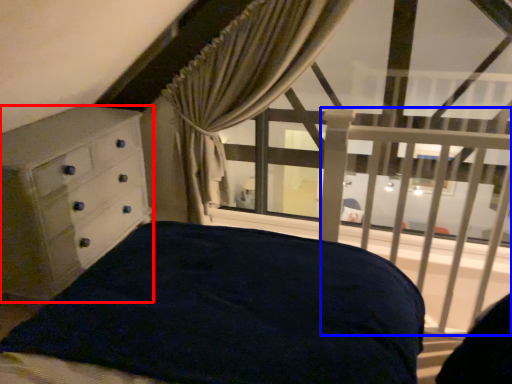
Question: Which object appears closest to the camera in this image, chest of drawers (highlighted by a red box) or balustrade (highlighted by a blue box)?

Choices:
 (A) chest of drawers
 (B) balustrade

Answer: (B)